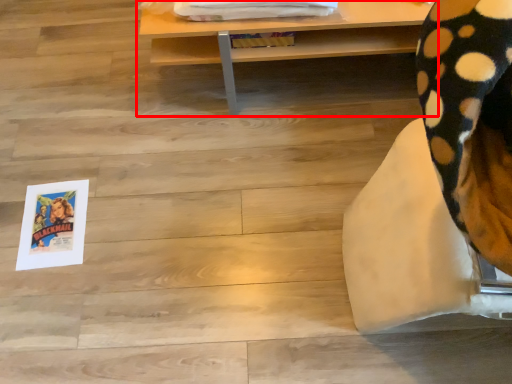
Question: From the image's perspective, where is table (annotated by the red box) located in relation to furniture in the image?

Choices:
 (A) above
 (B) below

Answer: (A)